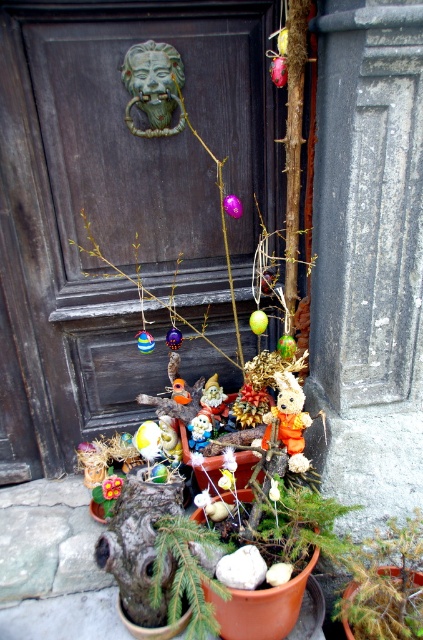
Which is in front, point (178, 76) or point (285, 445)?

Positioned in front is point (285, 445).

Which is below, green matte lion head at upper center or orange fabric rabbit at center?

orange fabric rabbit at center is below.

Does point (140, 54) lie in front of point (310, 417)?

That is False.

Where is `green matte lion head at upper center`? The image size is (423, 640). green matte lion head at upper center is located at coordinates (153, 86).

Based on the photo, is green matte plant at center taller than green matte lion head at upper center?

Correct, green matte plant at center is much taller as green matte lion head at upper center.

Looking at this image, between green matte plant at center and green matte lion head at upper center, which one has less height?

green matte lion head at upper center is shorter.

Which is in front, point (192, 584) or point (132, 74)?

Point (192, 584) is more forward.

The image size is (423, 640). What are the coordinates of `green matte plant at center` in the screenshot? It's located at (186, 573).

Is point (195, 570) more distant than point (299, 442)?

No, (195, 570) is closer to viewer.

Who is more forward, (194, 621) or (283, 388)?

Point (194, 621)

Between point (184, 557) and point (288, 452), which one is positioned behind?

Positioned behind is point (288, 452).

The height and width of the screenshot is (640, 423). I want to click on green matte plant at center, so click(x=186, y=573).